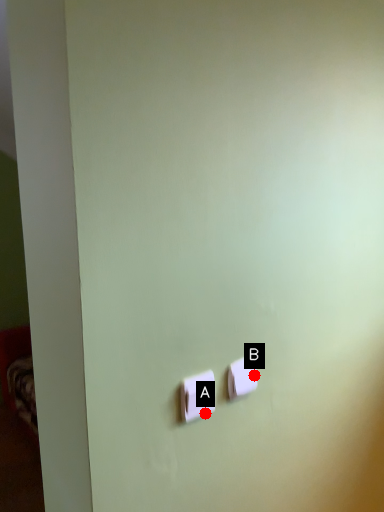
Question: Two points are circled on the image, labeled by A and B beside each circle. Which of the following is the farthest from the observer?

Choices:
 (A) A is further
 (B) B is further

Answer: (B)